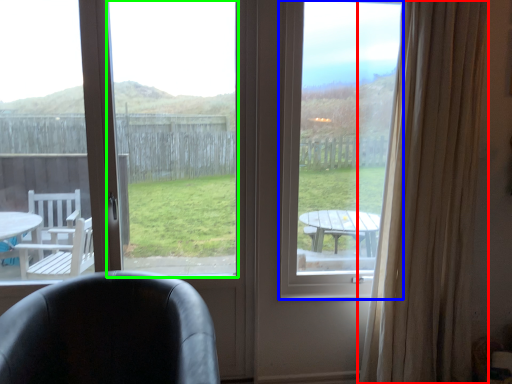
Question: Which object is positioned closest to curtain (highlighted by a red box)? Select from window screen (highlighted by a blue box) and window screen (highlighted by a green box).

Choices:
 (A) window screen
 (B) window screen

Answer: (A)